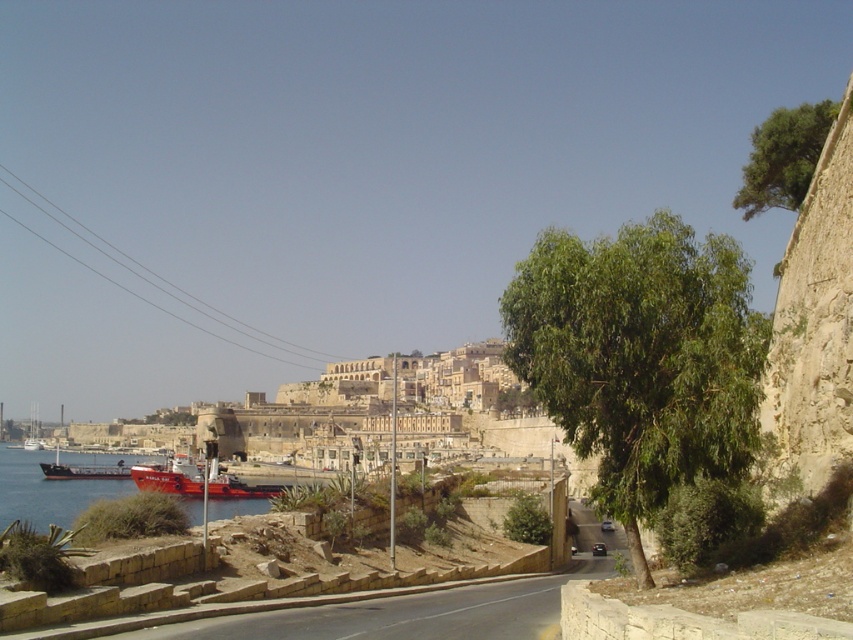
Can you confirm if green leafy tree at upper right is smaller than red matte ship at left?

Incorrect, green leafy tree at upper right is not smaller in size than red matte ship at left.

Looking at this image, between green leafy tree at upper right and red matte ship at left, which one is positioned higher?

green leafy tree at upper right

Between point (759, 148) and point (67, 476), which one is positioned in front?

Point (759, 148) is in front.

In order to click on green leafy tree at upper right in this screenshot , I will do (x=782, y=157).

Is green leafy tree at upper right bigger than red matte ship at lower left?

Correct, green leafy tree at upper right is larger in size than red matte ship at lower left.

Image resolution: width=853 pixels, height=640 pixels. What do you see at coordinates (782, 157) in the screenshot?
I see `green leafy tree at upper right` at bounding box center [782, 157].

Describe the element at coordinates (782, 157) in the screenshot. I see `green leafy tree at upper right` at that location.

Locate an element on the screen. green leafy tree at upper right is located at coordinates (782, 157).

Between green leafy tree at center and green leafy tree at upper right, which one appears on the left side from the viewer's perspective?

From the viewer's perspective, green leafy tree at center appears more on the left side.

Does point (612, 292) come in front of point (804, 141)?

Yes, point (612, 292) is in front of point (804, 141).

This screenshot has height=640, width=853. What do you see at coordinates (641, 358) in the screenshot?
I see `green leafy tree at center` at bounding box center [641, 358].

Image resolution: width=853 pixels, height=640 pixels. In order to click on green leafy tree at center in this screenshot , I will do `click(641, 358)`.